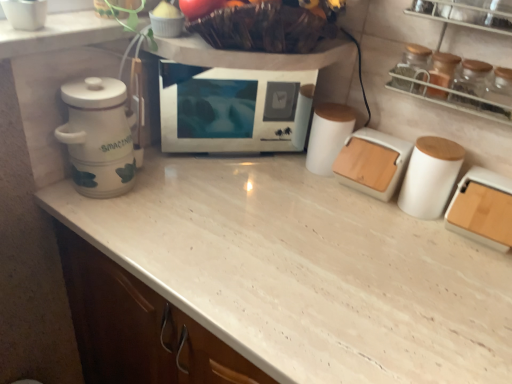
I want to click on free space in front of wooden lid container at right, which is the third kitchen appliance from left to right, so click(469, 292).